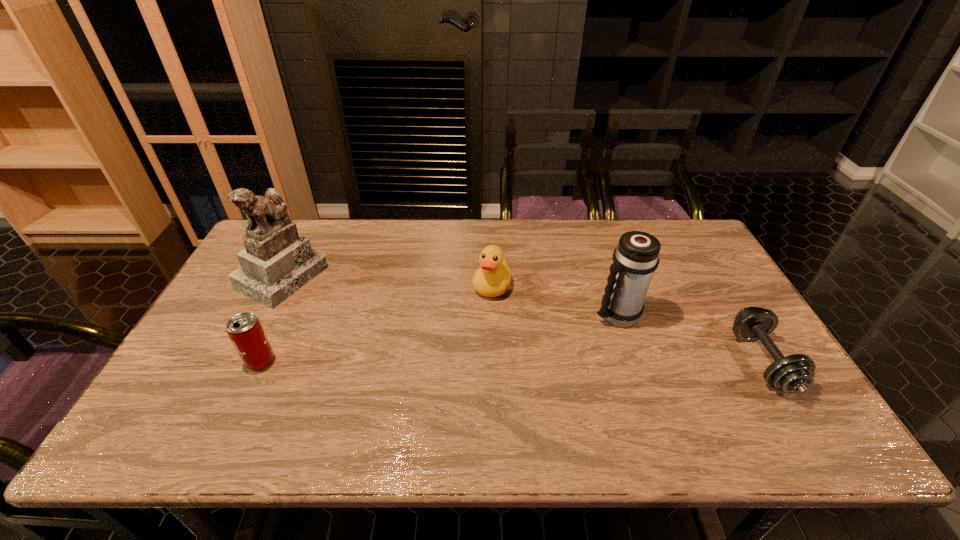
The image size is (960, 540). I want to click on empty location between the second tallest object and the beer can, so [x=439, y=338].

I want to click on vacant point located between the beer can and the third object from right to left, so click(x=376, y=323).

Locate an element on the screen. The height and width of the screenshot is (540, 960). free space between the shortest object and the beer can is located at coordinates (512, 361).

Where is `empty location between the figurine and the third object from left to right`? This screenshot has width=960, height=540. empty location between the figurine and the third object from left to right is located at coordinates (388, 281).

The height and width of the screenshot is (540, 960). Identify the location of unoccupied position between the thermos bottle and the tallest object. (449, 295).

Where is `vacant area between the beer can and the shortest object`? vacant area between the beer can and the shortest object is located at coordinates (512, 361).

Locate an element on the screen. empty location between the beer can and the figurine is located at coordinates (272, 319).

This screenshot has height=540, width=960. In order to click on vacant space in between the thermos bottle and the beer can in this screenshot , I will do `click(439, 338)`.

Find the location of `object identified as the second closest to the second object from right to left`. object identified as the second closest to the second object from right to left is located at coordinates (492, 279).

The height and width of the screenshot is (540, 960). Find the location of `object that is the fourth closest to the dumbbell`. object that is the fourth closest to the dumbbell is located at coordinates (245, 331).